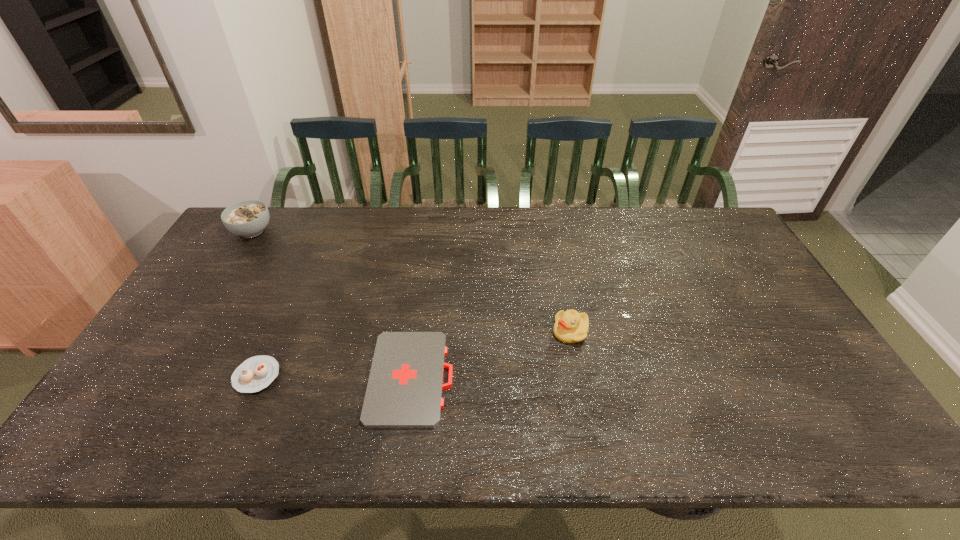
Locate an element on the screen. This screenshot has height=540, width=960. free region at the right edge is located at coordinates (x=820, y=393).

At what (x,y) coordinates should I click in order to perform the action: click on vacant space at the near left corner of the desktop. Please return your answer as a coordinate pair (x, y). Looking at the image, I should click on (150, 439).

Locate an element on the screen. vacant space in between the rightmost object and the first-aid kit is located at coordinates (491, 355).

Where is `free space between the shortest object and the leftmost object`? The height and width of the screenshot is (540, 960). free space between the shortest object and the leftmost object is located at coordinates pyautogui.click(x=332, y=305).

The width and height of the screenshot is (960, 540). I want to click on free point between the cupcake and the shortest object, so click(x=334, y=377).

This screenshot has width=960, height=540. What are the coordinates of `vacant area that lies between the duckling and the soup bowl` in the screenshot? It's located at (411, 281).

Locate an element on the screen. Image resolution: width=960 pixels, height=540 pixels. free point between the leftmost object and the third object from left to right is located at coordinates coord(332,305).

You are a GUI agent. You are given a task and a screenshot of the screen. Output one action in this format:
    pyautogui.click(x=<x>, y=<y>)
    Task: Click on the vacant space that is in between the farthest object and the third tallest object
    This screenshot has width=960, height=540.
    Given the screenshot: What is the action you would take?
    pyautogui.click(x=254, y=303)

Identify the location of vacant area that lies between the rightmost object and the first-aid kit. Image resolution: width=960 pixels, height=540 pixels. (491, 355).

Locate an element on the screen. The image size is (960, 540). empty space that is in between the soup bowl and the rightmost object is located at coordinates (411, 281).